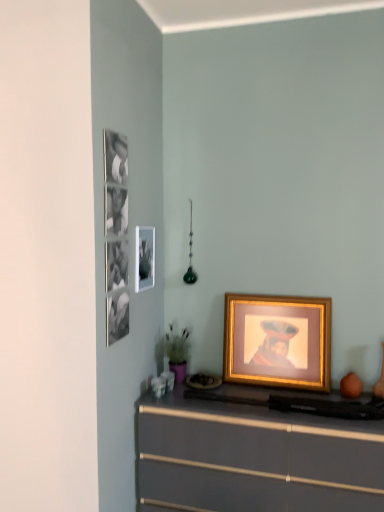
Question: Considering the relative sizes of matte gray chest of drawers at lower center and gold metallic picture frame at center, the first picture frame when ordered from right to left, in the image provided, is matte gray chest of drawers at lower center smaller than gold metallic picture frame at center, the first picture frame when ordered from right to left,?

Choices:
 (A) no
 (B) yes

Answer: (A)

Question: Can you confirm if matte gray chest of drawers at lower center is shorter than gold metallic picture frame at center, placed as the second picture frame when sorted from left to right?

Choices:
 (A) yes
 (B) no

Answer: (B)

Question: Is matte gray chest of drawers at lower center closer to the viewer compared to gold metallic picture frame at center, the first picture frame when ordered from right to left?

Choices:
 (A) no
 (B) yes

Answer: (B)

Question: Would you say gold metallic picture frame at center, placed as the second picture frame when sorted from left to right, is part of matte gray chest of drawers at lower center's contents?

Choices:
 (A) no
 (B) yes

Answer: (A)

Question: From a real-world perspective, is matte gray chest of drawers at lower center located beneath gold metallic picture frame at center, placed as the second picture frame when sorted from left to right?

Choices:
 (A) no
 (B) yes

Answer: (B)

Question: From the image's perspective, would you say matte gray chest of drawers at lower center is positioned over gold metallic picture frame at center, the first picture frame when ordered from right to left?

Choices:
 (A) no
 (B) yes

Answer: (A)

Question: Considering the relative sizes of metallic silver picture frame at upper left, arranged as the first picture frame when viewed from the top, and matte gray chest of drawers at lower center in the image provided, is metallic silver picture frame at upper left, arranged as the first picture frame when viewed from the top, smaller than matte gray chest of drawers at lower center?

Choices:
 (A) no
 (B) yes

Answer: (B)

Question: Would you say metallic silver picture frame at upper left, arranged as the first picture frame when viewed from the top, contains matte gray chest of drawers at lower center?

Choices:
 (A) yes
 (B) no

Answer: (B)

Question: Does metallic silver picture frame at upper left, the second picture frame from the bottom, touch matte gray chest of drawers at lower center?

Choices:
 (A) no
 (B) yes

Answer: (A)

Question: From the image's perspective, is metallic silver picture frame at upper left, arranged as the second picture frame when viewed from the right, on matte gray chest of drawers at lower center?

Choices:
 (A) yes
 (B) no

Answer: (A)

Question: Considering the relative sizes of metallic silver picture frame at upper left, arranged as the second picture frame when viewed from the right, and matte gray chest of drawers at lower center in the image provided, is metallic silver picture frame at upper left, arranged as the second picture frame when viewed from the right, thinner than matte gray chest of drawers at lower center?

Choices:
 (A) no
 (B) yes

Answer: (B)

Question: Is metallic silver picture frame at upper left, acting as the first picture frame starting from the left, at the left side of matte gray chest of drawers at lower center?

Choices:
 (A) no
 (B) yes

Answer: (B)

Question: From the image's perspective, is gold metallic picture frame at center, the first picture frame when ordered from right to left, located above matte gray chest of drawers at lower center?

Choices:
 (A) yes
 (B) no

Answer: (A)